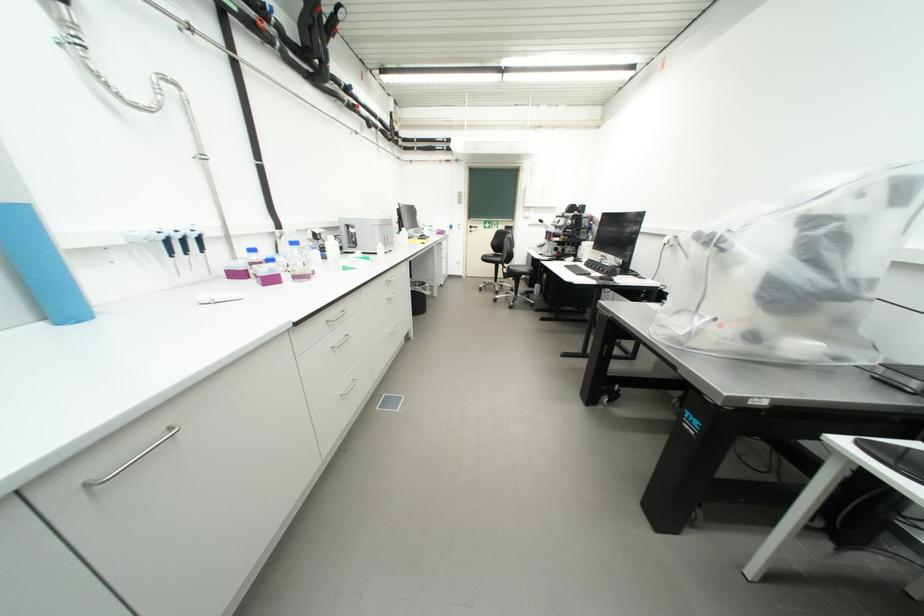
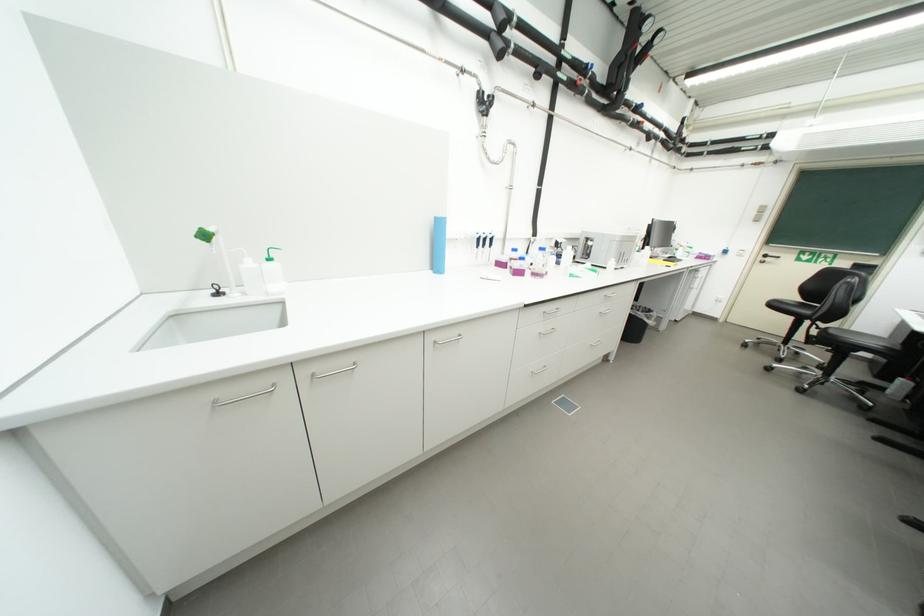
Locate, in the second image, the point that corresponds to (x=244, y=276) in the first image.

(507, 265)